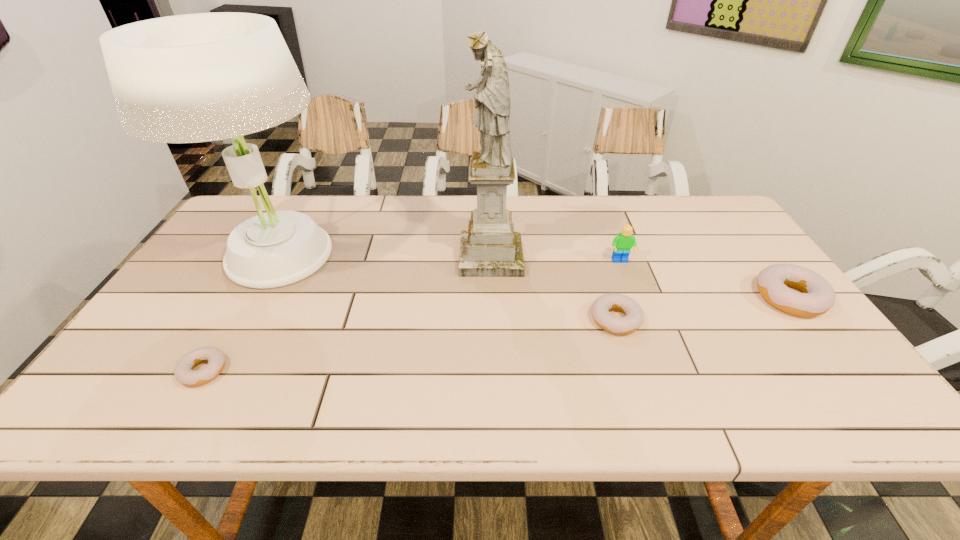
Locate an element on the screen. the closest doughnut to the sculpture is located at coordinates coord(634,318).

Point out which doughnut is positioned as the second nearest to the fourth object from right to left. Please provide its 2D coordinates. Your answer should be formatted as a tuple, i.e. [(x, y)], where the tuple contains the x and y coordinates of a point satisfying the conditions above.

[(184, 373)]

Locate an element on the screen. The height and width of the screenshot is (540, 960). free location that satisfies the following two spatial constraints: 1. on the front-facing side of the lamp; 2. on the left side of the rightmost doughnut is located at coordinates (254, 298).

Find the location of a particular element. blank area in the image that satisfies the following two spatial constraints: 1. on the front-facing side of the lamp; 2. on the right side of the third shortest object is located at coordinates tap(254, 298).

Identify the location of free space that satisfies the following two spatial constraints: 1. on the front-facing side of the lamp; 2. on the right side of the fifth tallest object. (243, 320).

The image size is (960, 540). What are the coordinates of `vacant space that satisfies the following two spatial constraints: 1. on the front-facing side of the sculpture; 2. on the back side of the second shortest doughnut` in the screenshot? It's located at (493, 320).